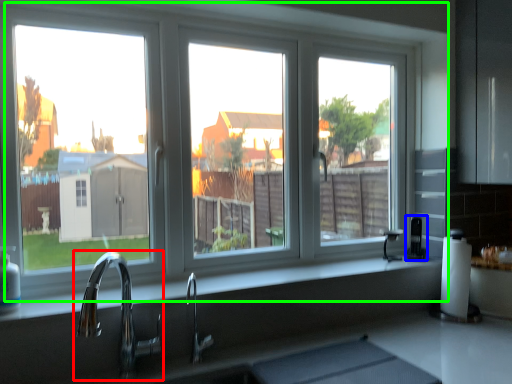
Question: Which object is positioned closest to tap (highlighted by a red box)? Select from appliance (highlighted by a blue box) and window (highlighted by a green box).

Choices:
 (A) appliance
 (B) window

Answer: (B)